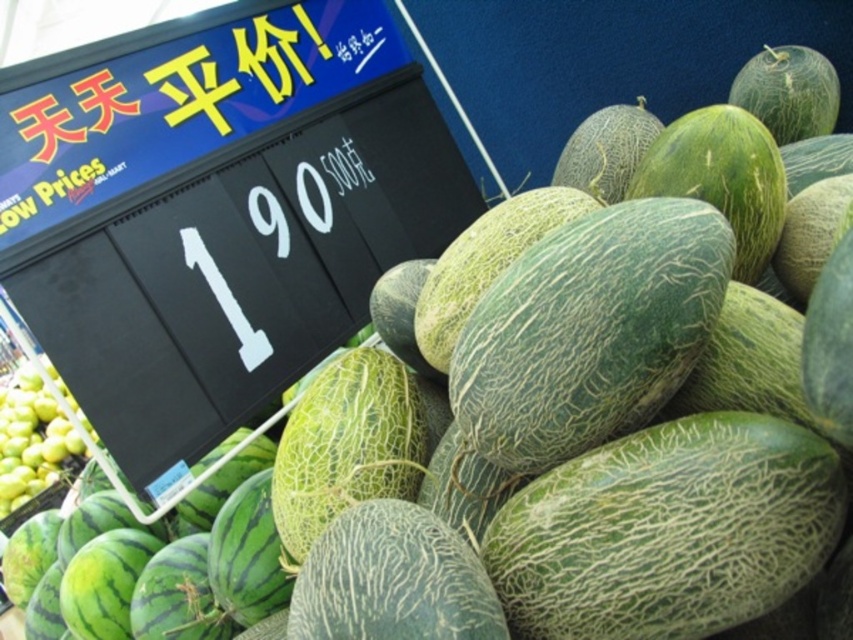
Question: Can you confirm if black plastic signboard at upper left is positioned to the left of green matte apples at lower left?

Choices:
 (A) no
 (B) yes

Answer: (A)

Question: Which point is farther from the camera taking this photo?

Choices:
 (A) (622, 328)
 (B) (4, 467)
 (C) (408, 125)

Answer: (B)

Question: Among these objects, which one is farthest from the camera?

Choices:
 (A) green matte apples at lower left
 (B) green textured melon at center
 (C) black plastic signboard at upper left

Answer: (A)

Question: Observing the image, what is the correct spatial positioning of black plastic signboard at upper left in reference to green textured melon at center?

Choices:
 (A) left
 (B) right

Answer: (A)

Question: In this image, where is green textured melon at center located relative to green matte apples at lower left?

Choices:
 (A) left
 (B) right

Answer: (B)

Question: Which point is closer to the camera?

Choices:
 (A) green matte apples at lower left
 (B) black plastic signboard at upper left
 (C) green textured melon at center

Answer: (C)